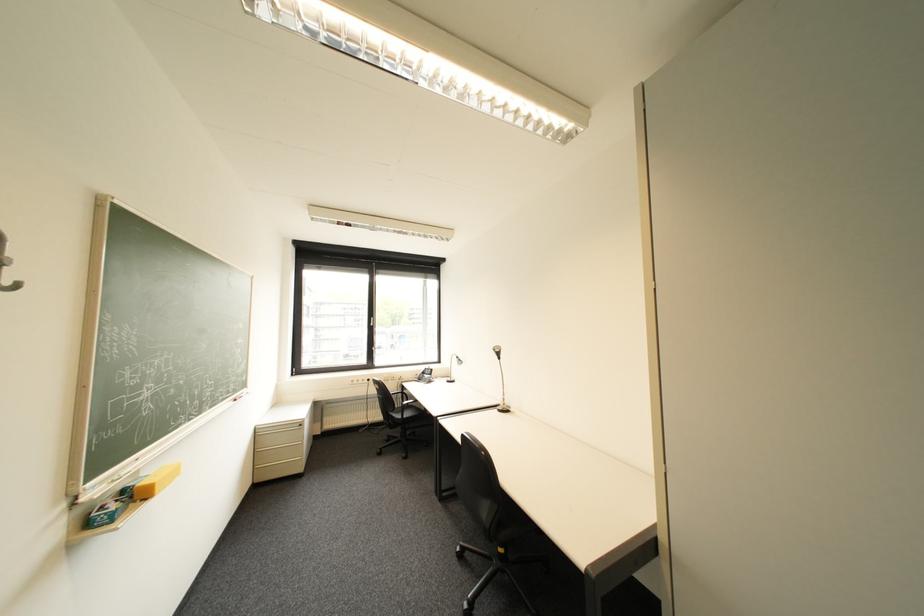
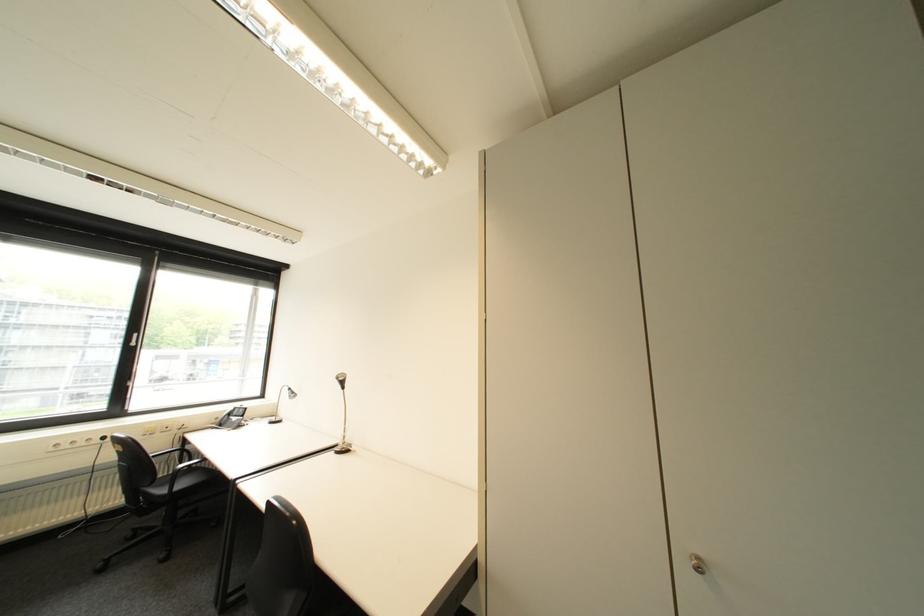
Question: The camera is either moving clockwise (left) or counter-clockwise (right) around the object. The first image is from the beginning of the video and the second image is from the end. Is the camera moving left or right when shooting the video?

Choices:
 (A) Left
 (B) Right

Answer: (A)